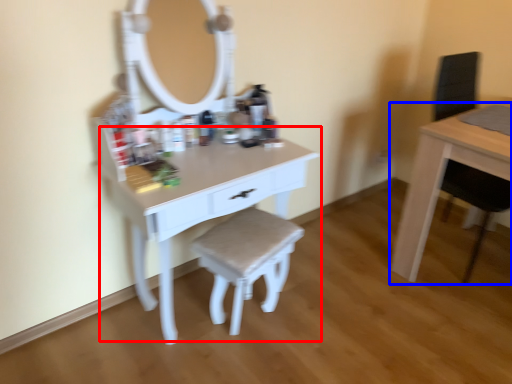
Question: Which point is closer to the camera, table (highlighted by a red box) or table (highlighted by a blue box)?

Choices:
 (A) table
 (B) table

Answer: (A)